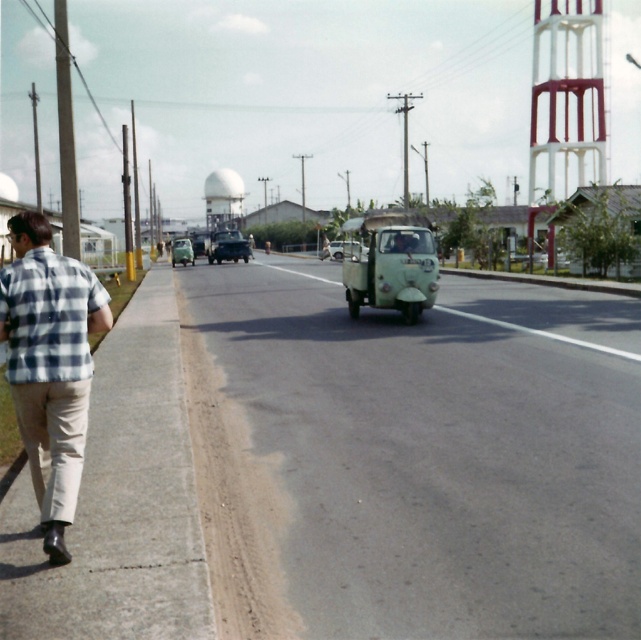
Question: Is the position of checkered fabric shirt at left more distant than that of green matte car at center?

Choices:
 (A) yes
 (B) no

Answer: (B)

Question: Observing the image, what is the correct spatial positioning of plaid cotton shirt at left in reference to white matte water tower at upper center?

Choices:
 (A) left
 (B) right

Answer: (B)

Question: Which object is positioned farthest from the checkered fabric shirt at left?

Choices:
 (A) metallic silver car at center
 (B) light green matte vehicle at center
 (C) white matte water tower at upper center
 (D) matte green car at center

Answer: (C)

Question: Is checkered fabric shirt at left closer to the viewer compared to metallic silver car at center?

Choices:
 (A) no
 (B) yes

Answer: (B)

Question: Which object is closer to the camera taking this photo?

Choices:
 (A) light green matte vehicle at center
 (B) metallic silver car at center
 (C) checkered fabric shirt at left
 (D) white matte water tower at upper center

Answer: (C)

Question: Which object is closer to the camera taking this photo?

Choices:
 (A) green matte car at center
 (B) metallic silver car at center

Answer: (A)